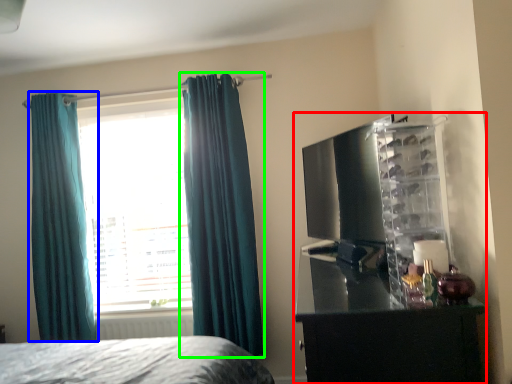
Question: Estimate the real-world distances between objects in this image. Which object is closer to entertainment center (highlighted by a red box), curtain (highlighted by a blue box) or curtain (highlighted by a green box)?

Choices:
 (A) curtain
 (B) curtain

Answer: (B)